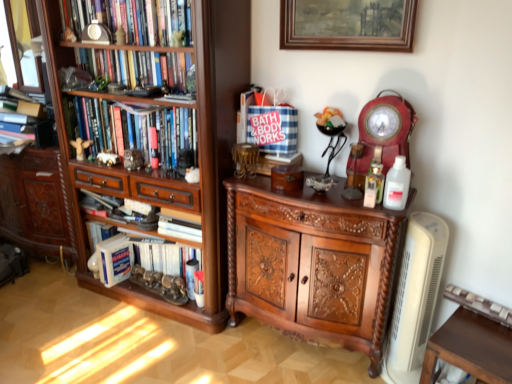
I want to click on free spot to the left of white plastic bottle at right, so click(x=352, y=202).